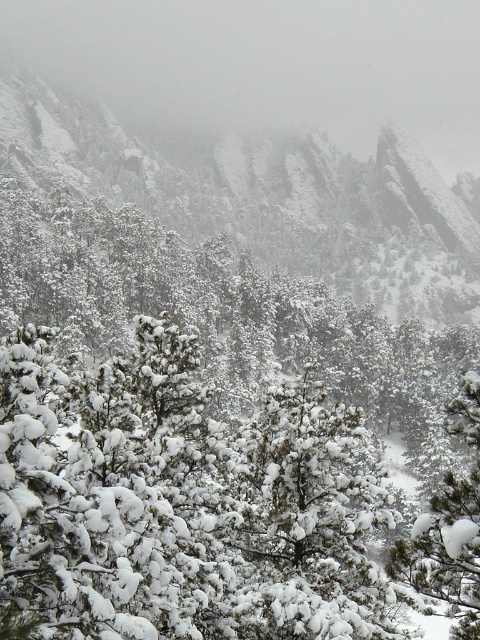
Which is above, snow-covered evergreen at center or snow-covered rock at center?

snow-covered rock at center is higher up.

Find the location of a particular element. The image size is (480, 640). snow-covered evergreen at center is located at coordinates (182, 448).

Describe the element at coordinates (182, 448) in the screenshot. Image resolution: width=480 pixels, height=640 pixels. I see `snow-covered evergreen at center` at that location.

You are a GUI agent. You are given a task and a screenshot of the screen. Output one action in this format:
    pyautogui.click(x=<x>, y=<y>)
    Task: Click on the snow-covered evergreen at center
    This screenshot has height=640, width=480.
    Given the screenshot: What is the action you would take?
    pyautogui.click(x=182, y=448)

Between snow-covered rock at center and white fluffy snow at center, which one has more height?

Standing taller between the two is snow-covered rock at center.

Can you confirm if snow-covered rock at center is positioned above white fluffy snow at center?

Yes, snow-covered rock at center is above white fluffy snow at center.

What are the coordinates of `snow-covered rock at center` in the screenshot? It's located at tap(266, 196).

Identify the location of snow-covered rock at center. Image resolution: width=480 pixels, height=640 pixels. (266, 196).

Is snow-covered evergreen at center to the right of white fluffy snow at center from the viewer's perspective?

In fact, snow-covered evergreen at center is to the left of white fluffy snow at center.

Is point (41, 547) closer to camera compared to point (412, 557)?

Yes, it is.

What are the coordinates of `snow-covered evergreen at center` in the screenshot? It's located at (182, 448).